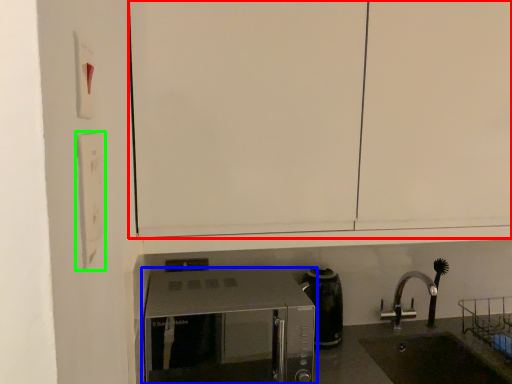
Question: Based on their relative distances, which object is nearer to cabinetry (highlighted by a red box)? Choose from microwave oven (highlighted by a blue box) and light switch (highlighted by a green box).

Choices:
 (A) microwave oven
 (B) light switch

Answer: (B)